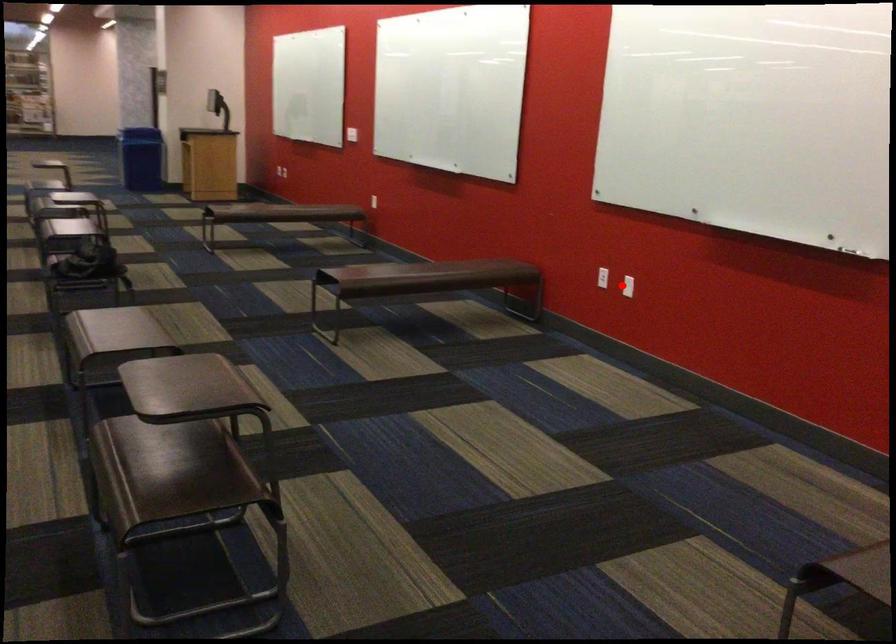
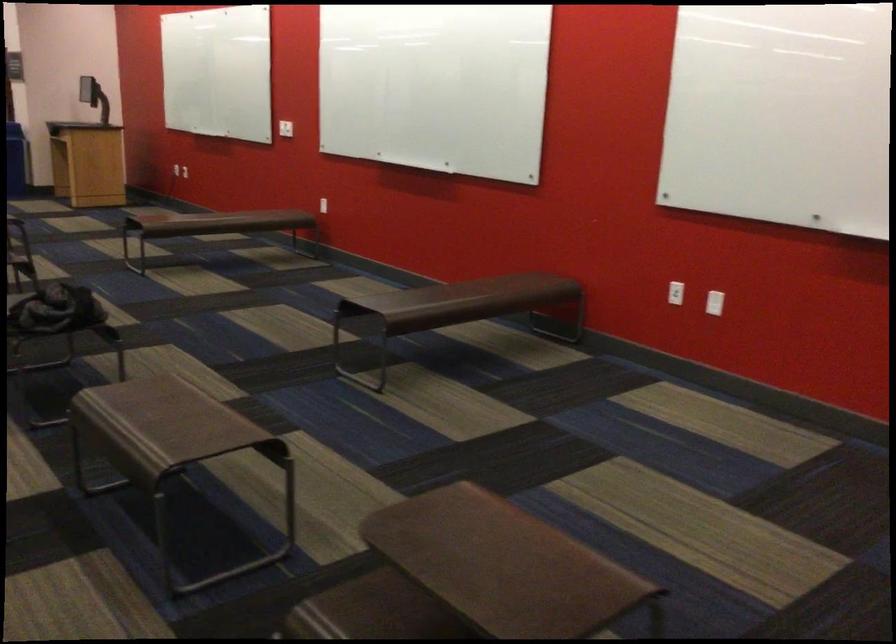
Locate, in the second image, the point that corresponds to the highlighted location in the first image.

(713, 303)